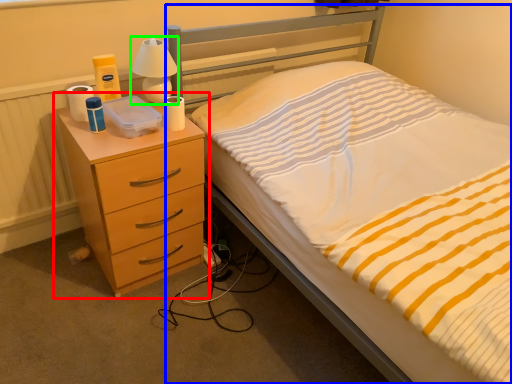
Question: Based on their relative distances, which object is farther from chest of drawers (highlighted by a red box)? Choose from bed (highlighted by a blue box) and bedside lamp (highlighted by a green box).

Choices:
 (A) bed
 (B) bedside lamp

Answer: (B)